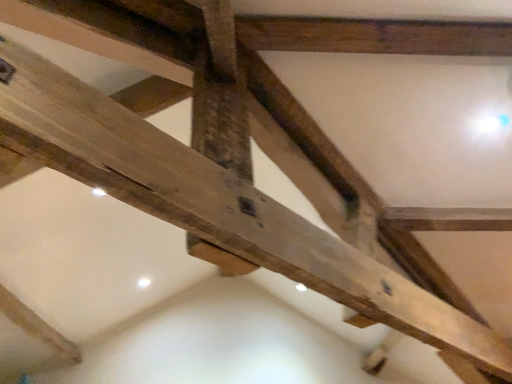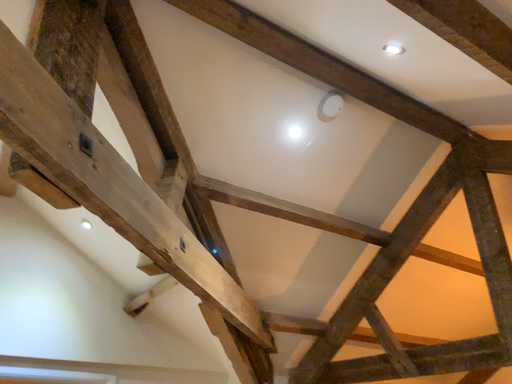
Question: Which way did the camera rotate in the video?

Choices:
 (A) rotated left
 (B) rotated right

Answer: (B)